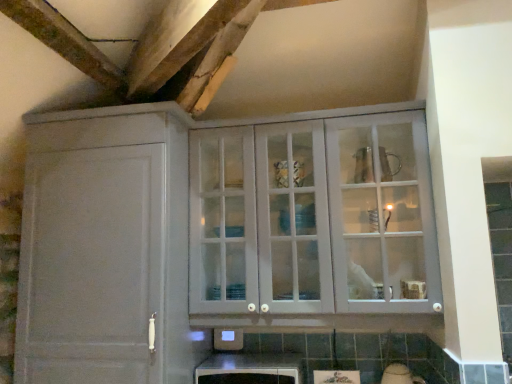
Question: Considering the relative sizes of white glass cabinet at upper center and matte gray cabinet at upper center, which appears as the second cabinetry when viewed from the right, in the image provided, is white glass cabinet at upper center wider than matte gray cabinet at upper center, which appears as the second cabinetry when viewed from the right,?

Choices:
 (A) yes
 (B) no

Answer: (B)

Question: Would you consider white glass cabinet at upper center to be distant from matte gray cabinet at upper center, which appears as the second cabinetry when viewed from the right?

Choices:
 (A) yes
 (B) no

Answer: (B)

Question: From a real-world perspective, does white glass cabinet at upper center sit lower than matte gray cabinet at upper center, the first cabinetry viewed from the left?

Choices:
 (A) no
 (B) yes

Answer: (A)

Question: Is white glass cabinet at upper center next to matte gray cabinet at upper center, which appears as the second cabinetry when viewed from the right?

Choices:
 (A) no
 (B) yes

Answer: (A)

Question: Is white glass cabinet at upper center to the left of matte gray cabinet at upper center, which appears as the second cabinetry when viewed from the right, from the viewer's perspective?

Choices:
 (A) no
 (B) yes

Answer: (A)

Question: Is white glossy microwave at lower center, arranged as the 2th cabinetry when viewed from the left, spatially inside matte gray cabinet at upper center, which appears as the second cabinetry when viewed from the right, or outside of it?

Choices:
 (A) outside
 (B) inside

Answer: (A)

Question: From a real-world perspective, is white glossy microwave at lower center, arranged as the 2th cabinetry when viewed from the left, positioned above or below matte gray cabinet at upper center, which appears as the second cabinetry when viewed from the right?

Choices:
 (A) above
 (B) below

Answer: (B)

Question: In terms of size, does white glossy microwave at lower center, arranged as the 2th cabinetry when viewed from the left, appear bigger or smaller than matte gray cabinet at upper center, which appears as the second cabinetry when viewed from the right?

Choices:
 (A) small
 (B) big

Answer: (A)

Question: Considering the positions of white glossy microwave at lower center, marked as the first cabinetry in a right-to-left arrangement, and matte gray cabinet at upper center, which appears as the second cabinetry when viewed from the right, in the image, is white glossy microwave at lower center, marked as the first cabinetry in a right-to-left arrangement, taller or shorter than matte gray cabinet at upper center, which appears as the second cabinetry when viewed from the right,?

Choices:
 (A) tall
 (B) short

Answer: (B)

Question: In the image, is white glass cabinet at upper center on the left side or the right side of matte gray cabinet at upper center, which appears as the second cabinetry when viewed from the right?

Choices:
 (A) right
 (B) left

Answer: (A)

Question: From a real-world perspective, relative to matte gray cabinet at upper center, the first cabinetry viewed from the left, is white glass cabinet at upper center vertically above or below?

Choices:
 (A) above
 (B) below

Answer: (A)

Question: Considering the positions of white glass cabinet at upper center and matte gray cabinet at upper center, which appears as the second cabinetry when viewed from the right, in the image, is white glass cabinet at upper center wider or thinner than matte gray cabinet at upper center, which appears as the second cabinetry when viewed from the right,?

Choices:
 (A) thin
 (B) wide

Answer: (A)

Question: From the image's perspective, is white glass cabinet at upper center above or below matte gray cabinet at upper center, the first cabinetry viewed from the left?

Choices:
 (A) below
 (B) above

Answer: (B)

Question: Is white glossy microwave at lower center, marked as the first cabinetry in a right-to-left arrangement, wider or thinner than white glass cabinet at upper center?

Choices:
 (A) thin
 (B) wide

Answer: (A)

Question: From the image's perspective, relative to white glass cabinet at upper center, is white glossy microwave at lower center, arranged as the 2th cabinetry when viewed from the left, above or below?

Choices:
 (A) above
 (B) below

Answer: (B)